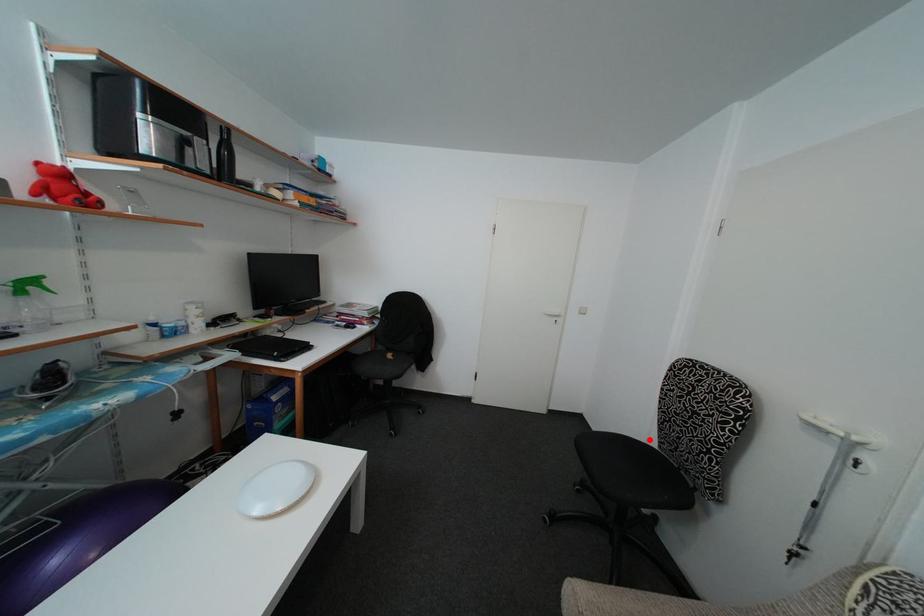
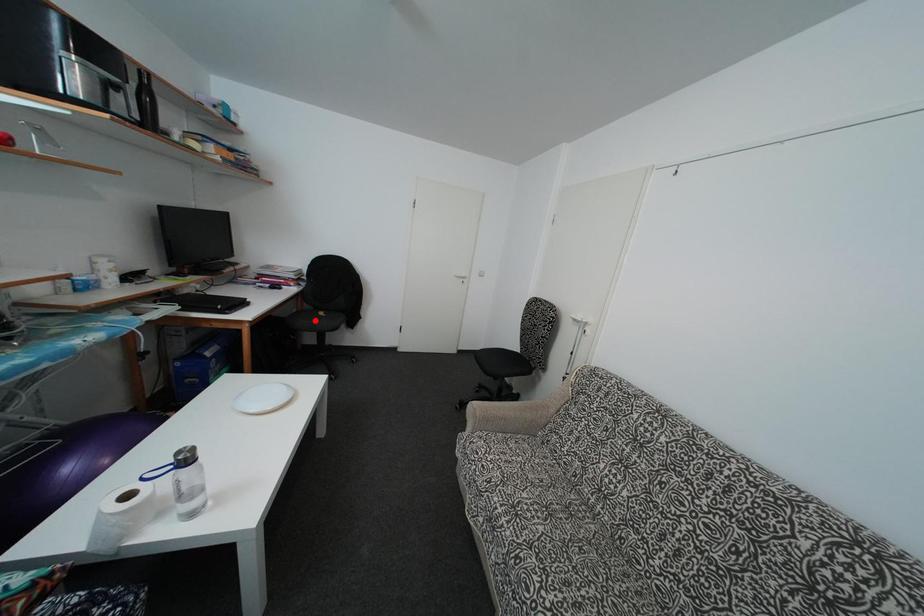
I am providing you with two images of the same scene from different viewpoints. A red point is marked on the first image and another point is marked on the second image. Do the highlighted points in image1 and image2 indicate the same real-world spot?

No